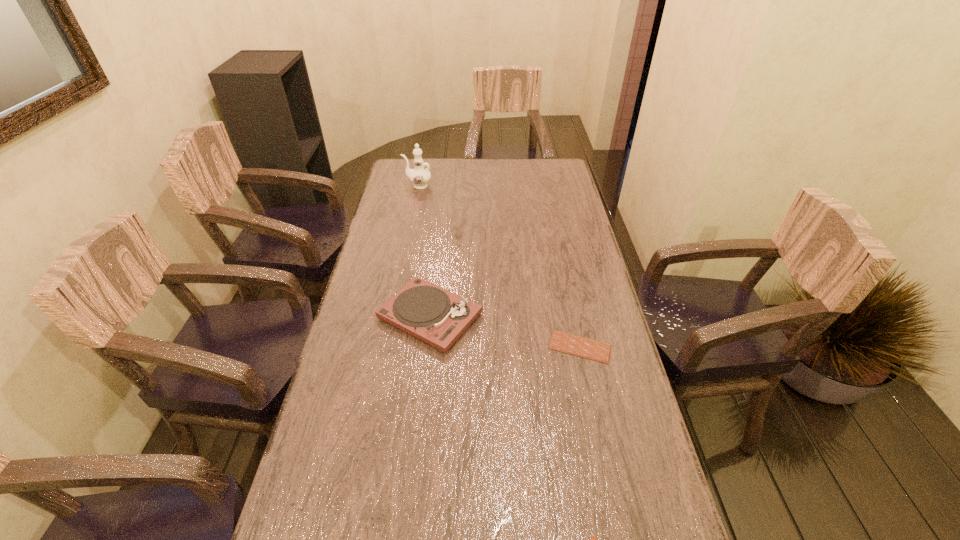
The image size is (960, 540). In order to click on object situated at the right edge in this screenshot , I will do `click(567, 343)`.

The height and width of the screenshot is (540, 960). In order to click on object that is at the far left corner in this screenshot , I will do 419,176.

The image size is (960, 540). Find the location of `free space at the far edge of the desktop`. free space at the far edge of the desktop is located at coordinates (444, 179).

In the image, there is a desktop. Find the location of `vacant space at the left edge`. vacant space at the left edge is located at coordinates (325, 478).

This screenshot has width=960, height=540. Find the location of `vacant position at the right edge of the desktop`. vacant position at the right edge of the desktop is located at coordinates (555, 251).

Where is `vacant space at the far left corner of the desktop`? vacant space at the far left corner of the desktop is located at coordinates (408, 159).

What are the coordinates of `free space at the far right corner of the desktop` in the screenshot? It's located at (554, 176).

Find the location of a particular element. This screenshot has height=540, width=960. unoccupied position between the second tallest object and the farther chocolate bar is located at coordinates (505, 332).

Identify the location of vacant area that lies between the phonograph_record and the farther chocolate bar. The height and width of the screenshot is (540, 960). (505, 332).

I want to click on free area in between the taller chocolate bar and the third shortest object, so click(505, 332).